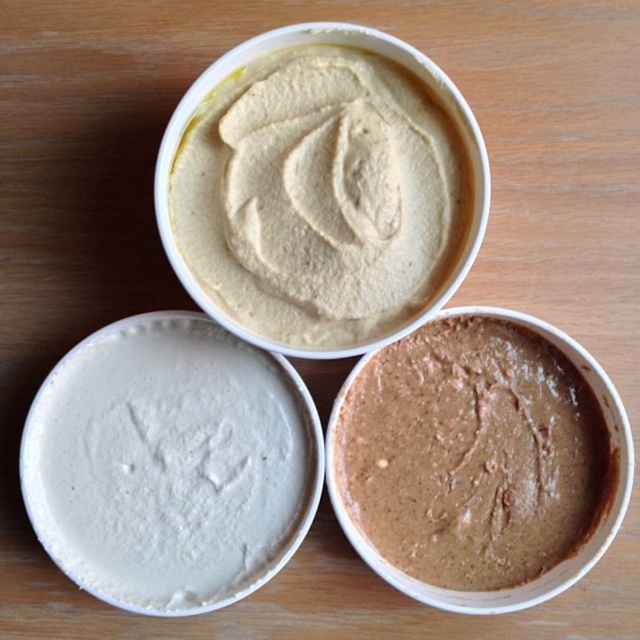
You are arranging two desserts on a plate. You have the white matte frosting at center and the smooth beige pudding at upper center. If you want to place them side by side, which one should you place first to ensure they fit properly?

The white matte frosting at center has a lesser width compared to the smooth beige pudding at upper center, so you should place the smooth beige pudding at upper center first to accommodate its larger size.

You are a baker who needs to determine which container is taller for a recipe that requires a specific height measurement. You see the white matte frosting at center and the brown matte hummus at bottom right. Which container is taller?

The white matte frosting at center is taller than the brown matte hummus at bottom right, so the white matte frosting at center is the taller container.

You are a food stylist arranging items on a table. You have a white matte frosting at center and a brown matte hummus at bottom right. You need to place a decorative plate between them. What is the minimum width the plate should be to fit between them?

The distance between the white matte frosting at center and the brown matte hummus at bottom right is 27.27 centimeters. Therefore, the decorative plate should be at least 27.27 centimeters wide to fit between them.